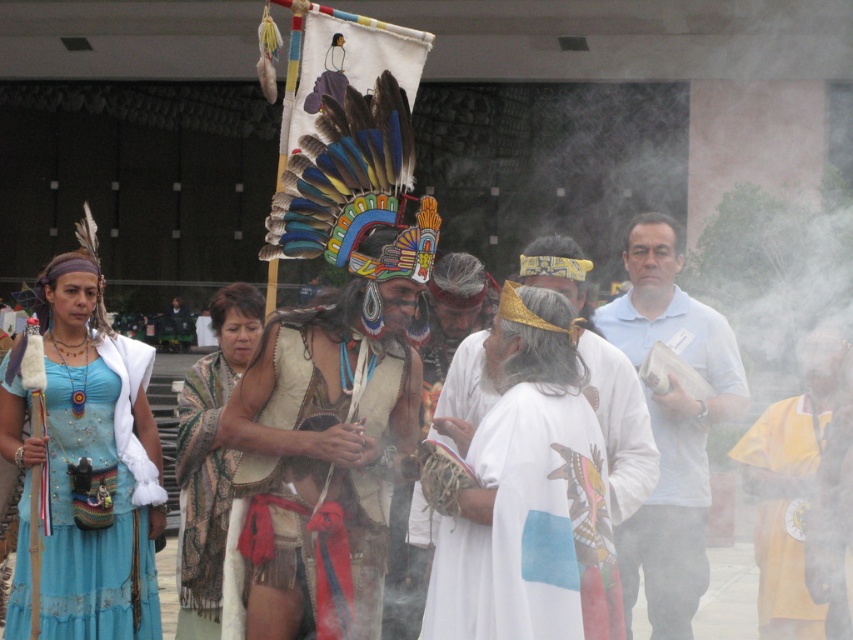
What object is located at the coordinates point (x=315, y=474)?

The leather fringe skirt at center is located at point (x=315, y=474).

You are standing at the point with coordinates point (830, 356) and want to walk towards the point (363, 554). Which direction should you move?

You should move forward because point (363, 554) is in front of point (830, 356).

You are an anthropologist observing a ceremonial gathering. You notice a point at coordinates (315,474) in the image. What object is located at this point?

The point at coordinates (315,474) corresponds to the leather fringe skirt at center.